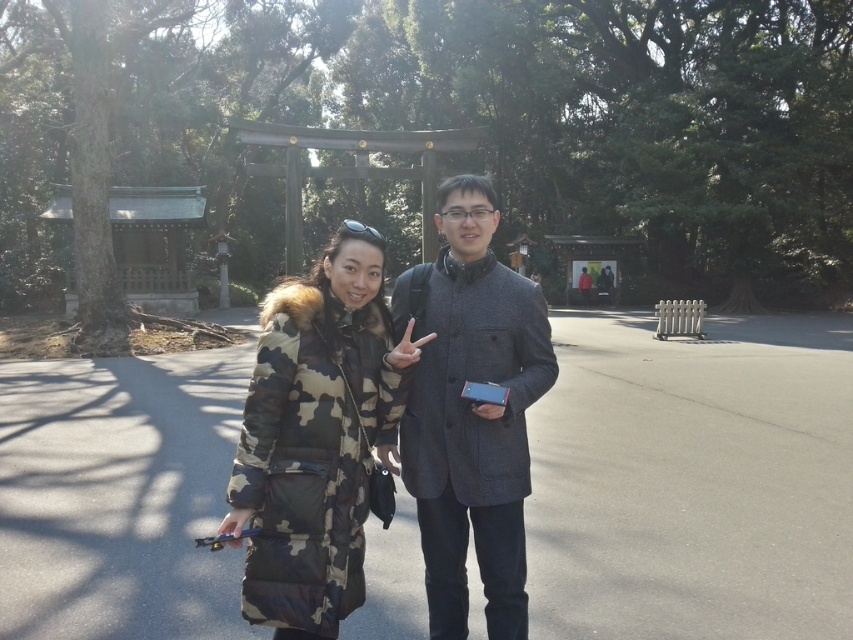
In the scene shown: Between camo fabric coat at center and gray wool coat at center, which one has less height?

camo fabric coat at center

Does point (259, 320) come behind point (439, 634)?

Yes, point (259, 320) is farther from viewer.

The height and width of the screenshot is (640, 853). Identify the location of camo fabric coat at center. (316, 436).